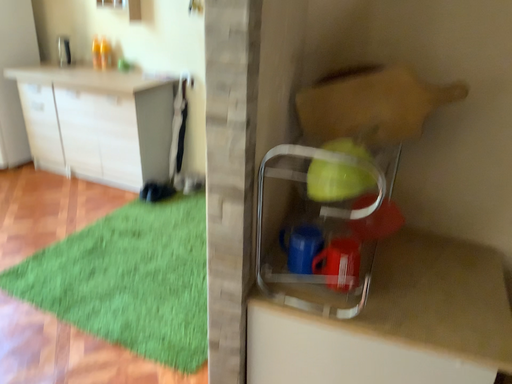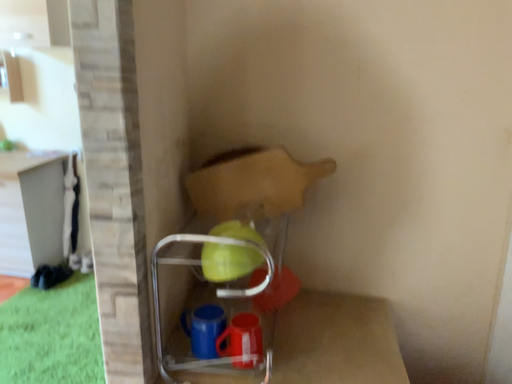
Question: Which way did the camera rotate in the video?

Choices:
 (A) rotated right
 (B) rotated left

Answer: (A)